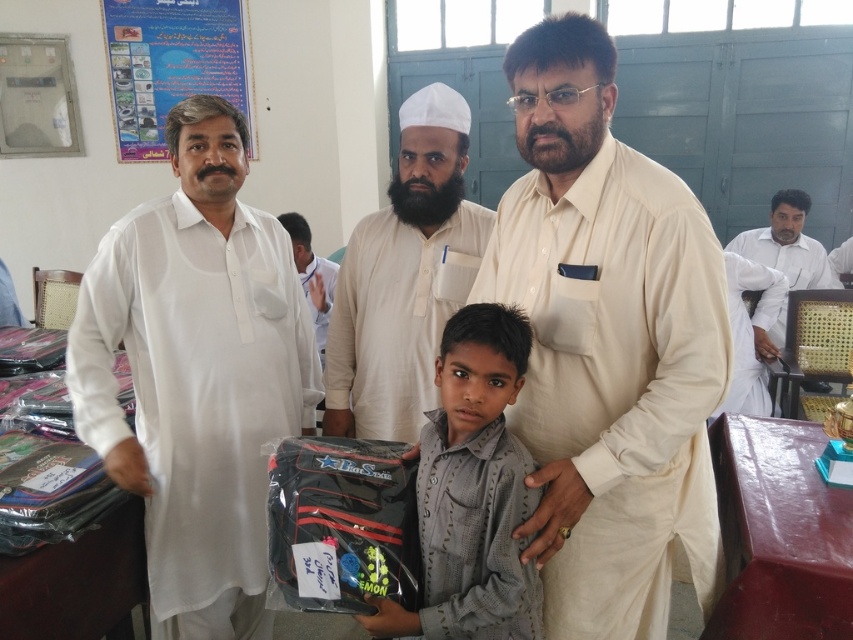
You are a visitor in the room and want to sit down. You see the blue paper poster at upper left and the white cotton chair at right. Which object should you approach if you want to sit?

The white cotton chair at right is the object you should approach to sit since it is a chair, while the blue paper poster at upper left is just a poster on the wall.

You are a visitor in the room and want to sit on the white cotton chair at right. The blue paper poster at upper left has some important information you need to read. Can you read the poster while sitting on the chair?

The blue paper poster at upper left is 3.13 meters from white cotton chair at right. Since the distance is 3.13 meters, you can easily read the poster while sitting on the chair as it is within a comfortable reading distance.

Based on the scene description, where is the white cotton shirt at center in relation to the blue paper poster at upper left?

The white cotton shirt at center is to the right of the blue paper poster at upper left.